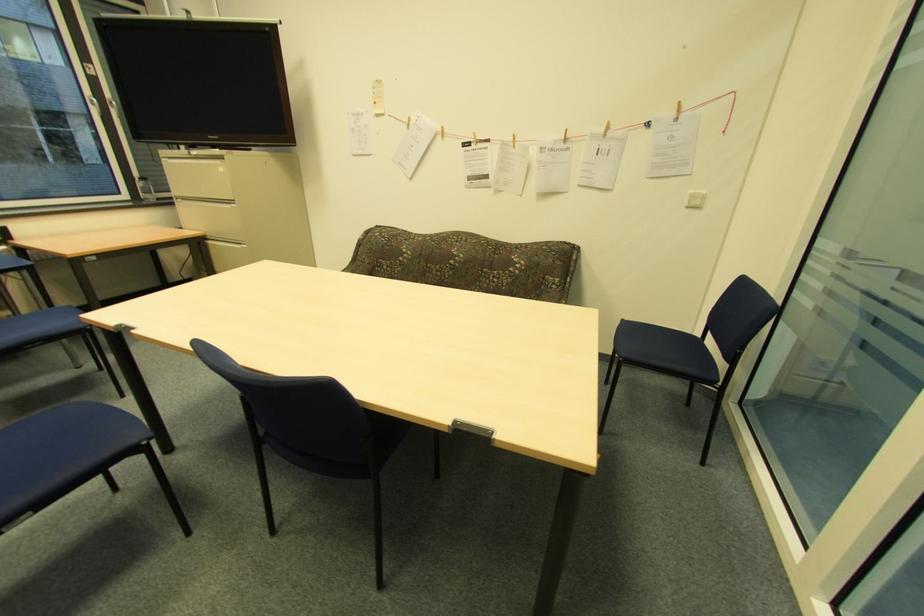
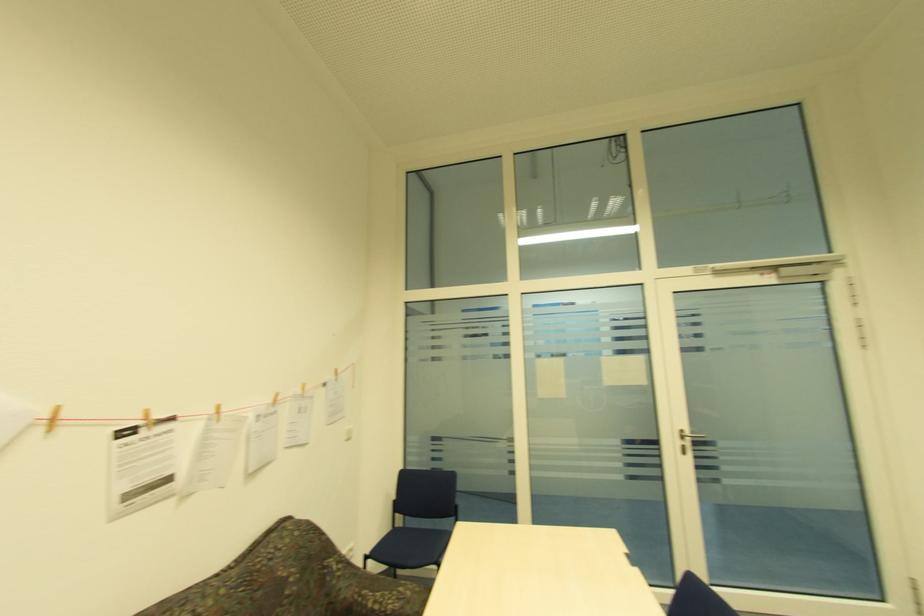
Where in the second image is the point corresponding to pixel 475 137 from the first image?

(141, 416)